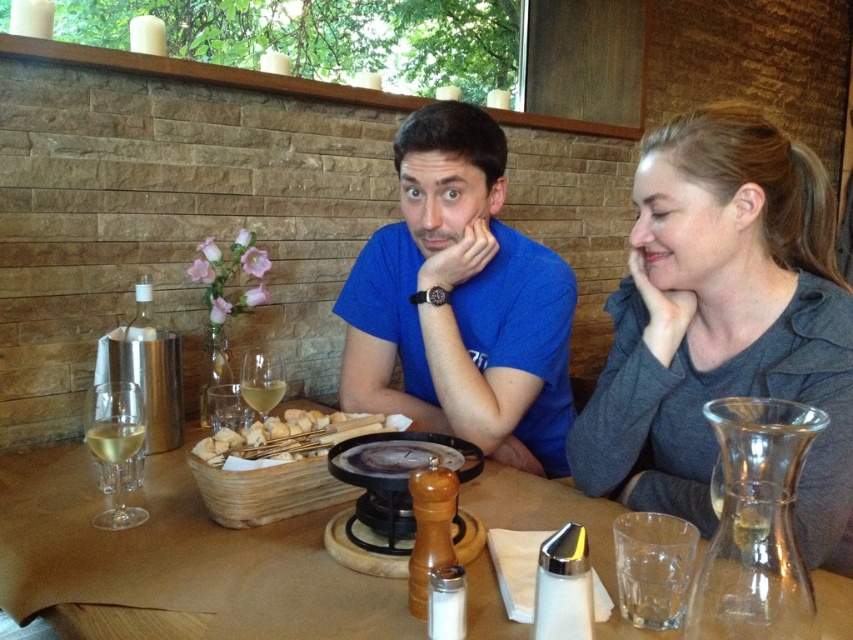
You are a waiter in a rustic restaurant. You need to place a new bread basket between the breadsticks at center and the clear glass wine glass at center. Which object should you place the basket closer to if the basket needs to be closer to the viewer?

The breadsticks at center are closer to the viewer than the clear glass wine glass at center, so you should place the basket closer to the breadsticks at center to ensure it is nearer to the viewer.

You are a waiter in a rustic restaurant. You need to place a new menu between the breadsticks at center and the translucent glass wine at center. Where should you place it so it is between them?

The breadsticks at center is on the right side of the translucent glass wine at center, so you should place the new menu to the left of the breadsticks at center and to the right of the translucent glass wine at center to position it between them.